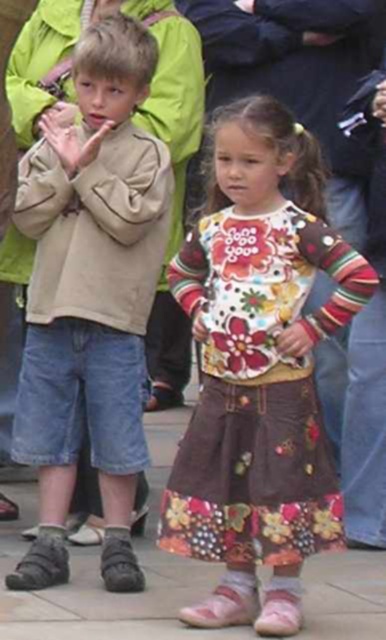
Question: Is light brown suede jacket at center smaller than floral cotton dress at center?

Choices:
 (A) yes
 (B) no

Answer: (A)

Question: Which object is the farthest from the floral cotton dress at center?

Choices:
 (A) light brown suede jacket at center
 (B) smooth concrete pavement at center

Answer: (B)

Question: Based on their relative distances, which object is nearer to the smooth concrete pavement at center?

Choices:
 (A) floral cotton dress at center
 (B) light brown suede jacket at center

Answer: (A)

Question: Estimate the real-world distances between objects in this image. Which object is closer to the floral cotton dress at center?

Choices:
 (A) smooth concrete pavement at center
 (B) light brown suede jacket at center

Answer: (B)

Question: Is light brown suede jacket at center bigger than smooth concrete pavement at center?

Choices:
 (A) yes
 (B) no

Answer: (A)

Question: Can you confirm if floral cotton dress at center is smaller than smooth concrete pavement at center?

Choices:
 (A) no
 (B) yes

Answer: (A)